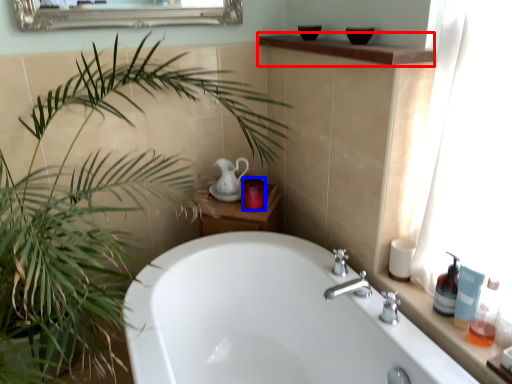
Question: Which point is closer to the camera, counter top (highlighted by a red box) or toiletry (highlighted by a blue box)?

Choices:
 (A) counter top
 (B) toiletry

Answer: (A)